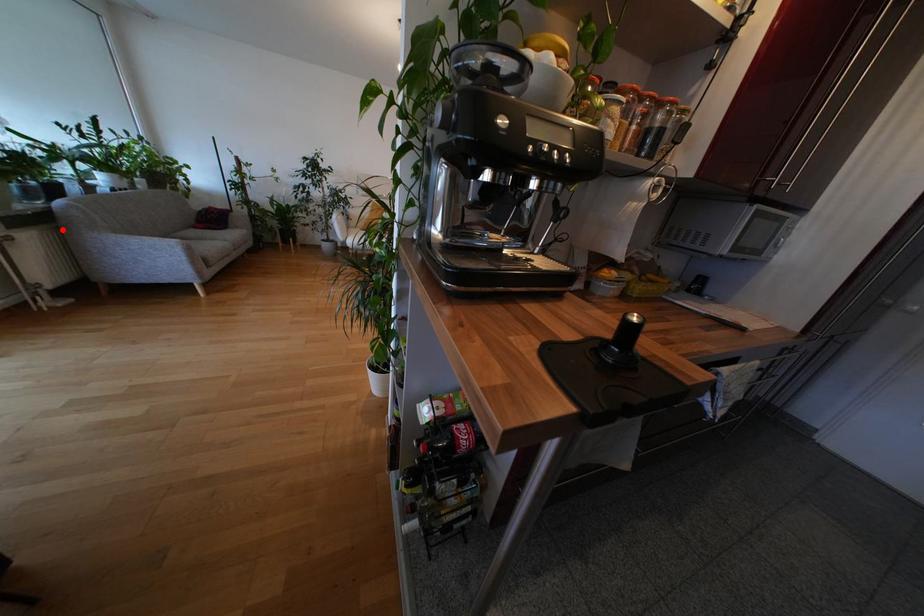
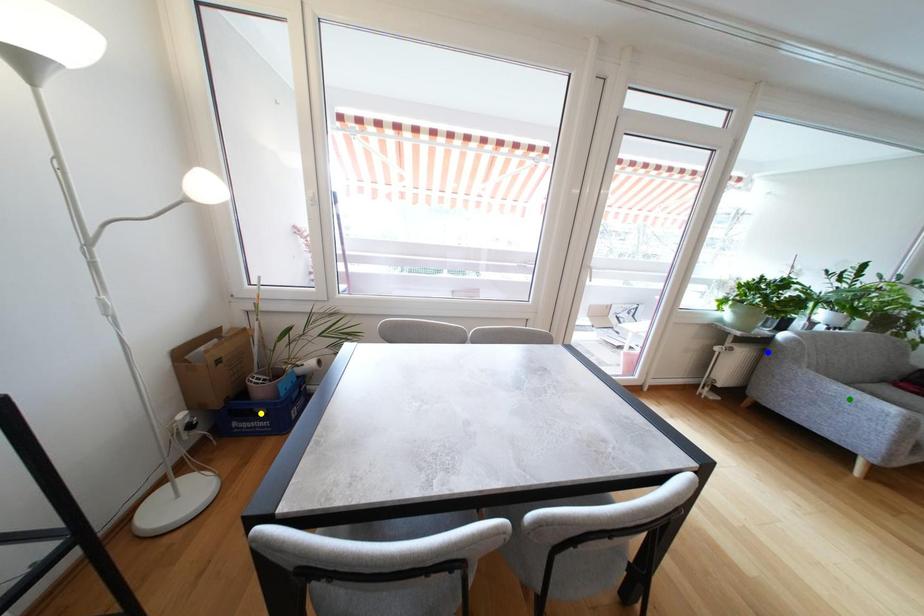
Question: I am providing you with two images of the same scene from different viewpoints. A red point is marked on the first image. You are given multiple points on the second image. Which point in image 2 represents the same 3d spot as the red point in image 1?

Choices:
 (A) blue point
 (B) green point
 (C) yellow point

Answer: (A)